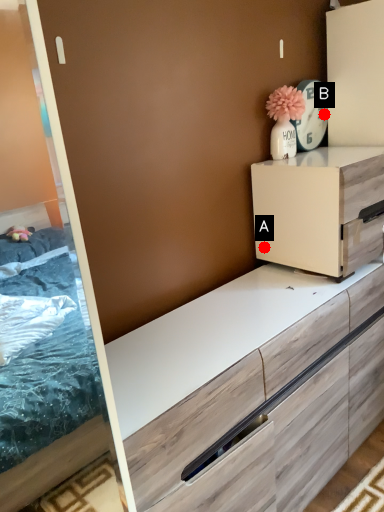
Question: Two points are circled on the image, labeled by A and B beside each circle. Which point is farther to the camera?

Choices:
 (A) A is further
 (B) B is further

Answer: (B)